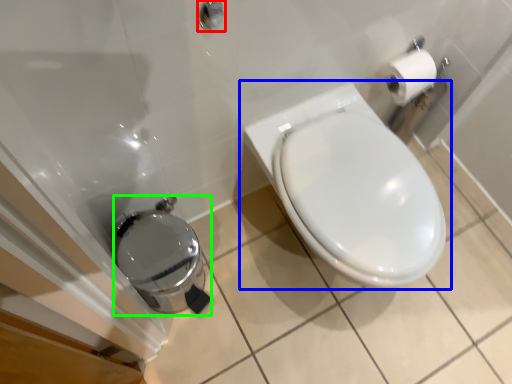
Question: Which object is the closest to the shower (highlighted by a red box)? Choose among these: toilet (highlighted by a blue box) or porcelain (highlighted by a green box).

Choices:
 (A) toilet
 (B) porcelain

Answer: (A)